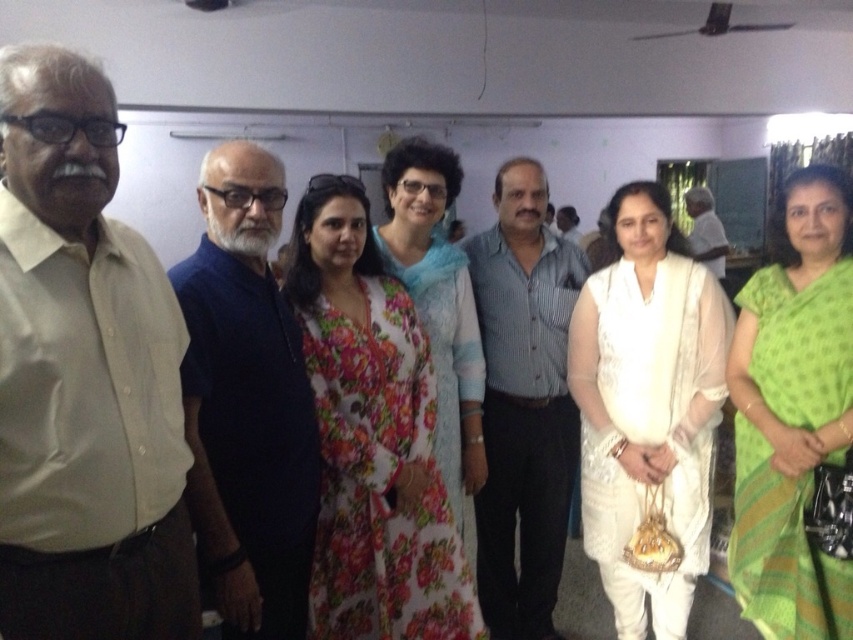
Is point (97, 426) positioned behind point (602, 544)?

That is False.

Does point (97, 548) come farther from viewer compared to point (570, 340)?

No, it is in front of (570, 340).

The image size is (853, 640). In order to click on beige shirt at left in this screenshot , I will do `click(83, 378)`.

Is point (61, 516) behind point (712, 266)?

That is False.

This screenshot has height=640, width=853. Find the location of `beige shirt at left`. beige shirt at left is located at coordinates (83, 378).

Between point (193, 618) and point (706, 221), which one is positioned in front?

Positioned in front is point (193, 618).

Find the location of `beige shirt at left`. beige shirt at left is located at coordinates (83, 378).

Can you confirm if dark blue shirt at center is wider than white cotton shirt at center?

No, dark blue shirt at center is not wider than white cotton shirt at center.

Which of these two, dark blue shirt at center or white cotton shirt at center, stands taller?

dark blue shirt at center

Between point (283, 385) and point (712, 204), which one is positioned in front?

Point (283, 385)

Identify the location of dark blue shirt at center. The height and width of the screenshot is (640, 853). (247, 404).